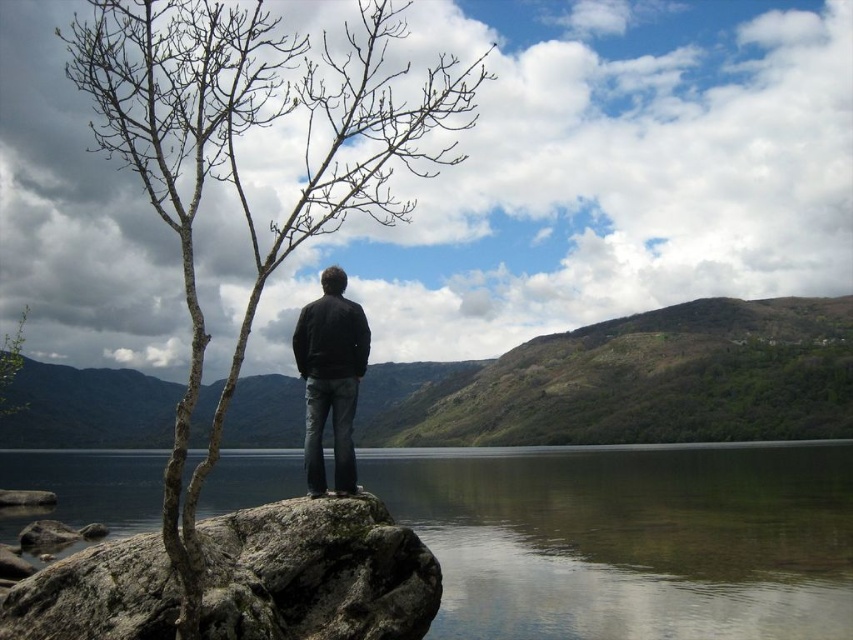
Does transparent water at center have a lesser width compared to bare branches at left?

Incorrect, transparent water at center's width is not less than bare branches at left's.

Between transparent water at center and bare branches at left, which one is positioned lower?

Positioned lower is transparent water at center.

Between point (456, 528) and point (318, 161), which one is positioned behind?

The point (318, 161) is behind.

The width and height of the screenshot is (853, 640). I want to click on transparent water at center, so click(x=631, y=538).

Which of these two, rough textured rock at lower left or black matte jacket at center, stands taller?

black matte jacket at center

Does point (393, 628) come in front of point (305, 310)?

Yes, it is in front of point (305, 310).

Is point (326, 564) positioned in front of point (306, 465)?

Yes, it is in front of point (306, 465).

Where is `rough textured rock at lower left`? rough textured rock at lower left is located at coordinates (315, 572).

Which is behind, point (189, 33) or point (311, 356)?

Point (311, 356)

Is point (376, 196) farther from camera compared to point (339, 451)?

That is False.

Which is in front, point (465, 83) or point (306, 445)?

Point (306, 445) is more forward.

Find the location of a particular element. The image size is (853, 640). bare branches at left is located at coordinates (236, 161).